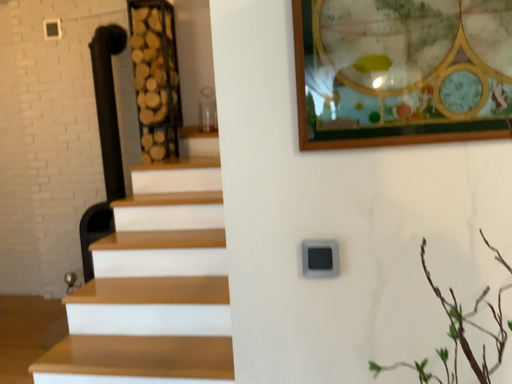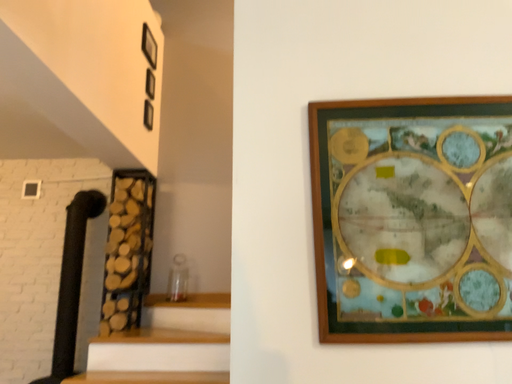
Question: How did the camera likely rotate when shooting the video?

Choices:
 (A) rotated downward
 (B) rotated upward

Answer: (B)